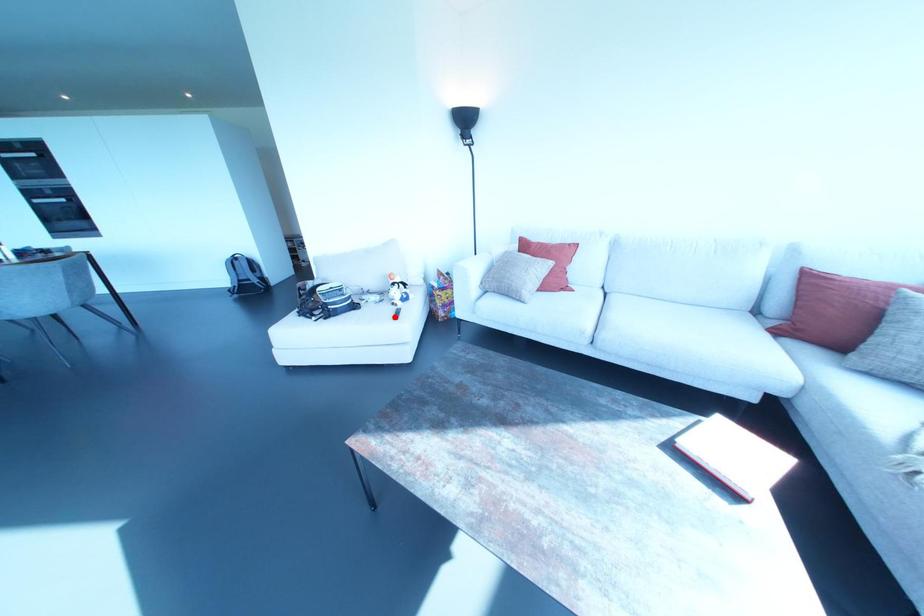
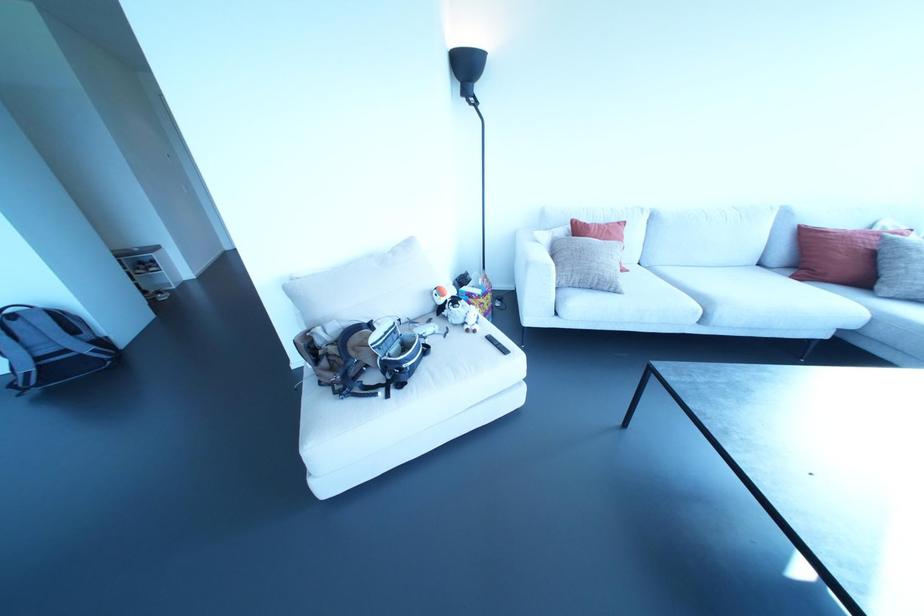
The point at the highlighted location is marked in the first image. Where is the corresponding point in the second image?

(504, 351)